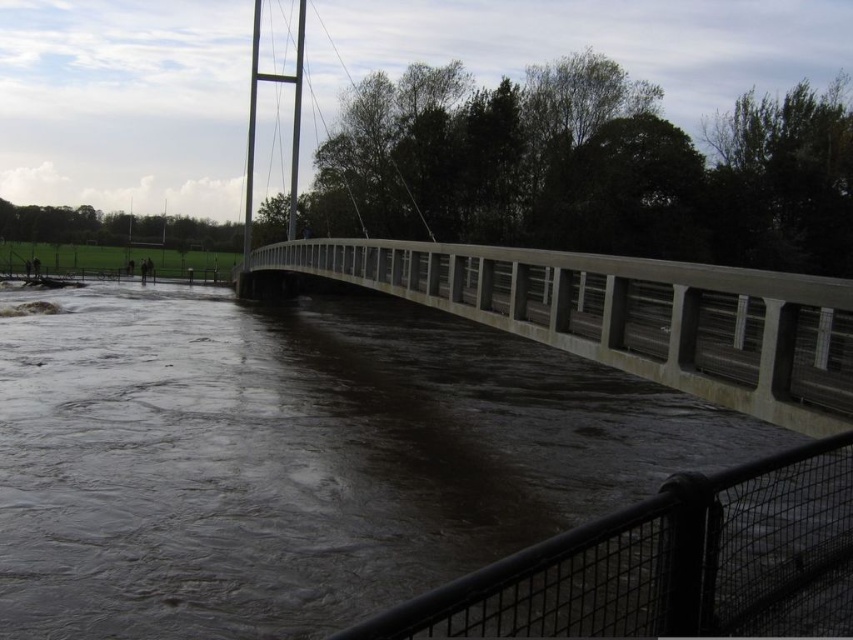
Question: Considering the relative positions of brown concrete river at center and concrete bridge at center in the image provided, where is brown concrete river at center located with respect to concrete bridge at center?

Choices:
 (A) above
 (B) below

Answer: (B)

Question: Which object appears closest to the camera in this image?

Choices:
 (A) brown concrete river at center
 (B) concrete bridge at center

Answer: (B)

Question: Does brown concrete river at center appear under concrete bridge at center?

Choices:
 (A) yes
 (B) no

Answer: (A)

Question: Is brown concrete river at center in front of concrete bridge at center?

Choices:
 (A) no
 (B) yes

Answer: (A)